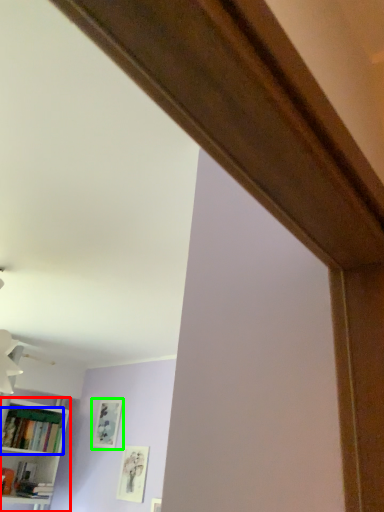
Question: Which is nearer to the bookcase (highlighted by a red box)? book (highlighted by a blue box) or picture frame (highlighted by a green box).

Choices:
 (A) book
 (B) picture frame

Answer: (A)